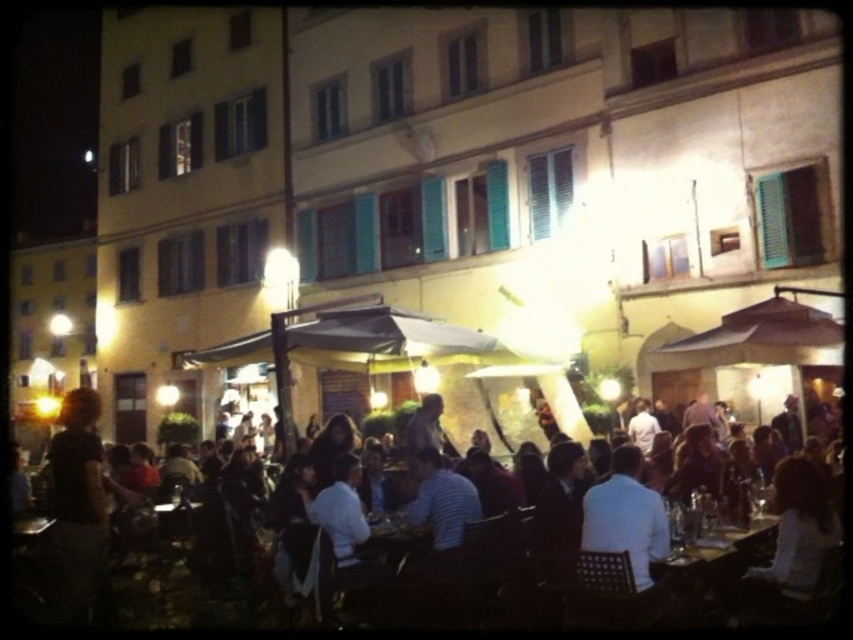
You are a photographer standing at the back of the scene. You want to take a photo of the white shirt at center and the wooden table at center without any obstruction. Based on their heights, which object should be positioned closer to the camera to ensure both are fully visible?

The white shirt at center is taller than the wooden table at center. To ensure both are fully visible without obstruction, the wooden table at center should be positioned closer to the camera so that the taller white shirt at center can be seen behind it.

You are a waiter at the restaurant and need to place a new tablecloth on the wooden table at center. However, you notice the dark brown leather jacket at center is currently covering part of the table. Can you estimate if the jacket is bigger than the table?

The dark brown leather jacket at center is larger in size than wooden table at center, so the jacket is bigger than the table.